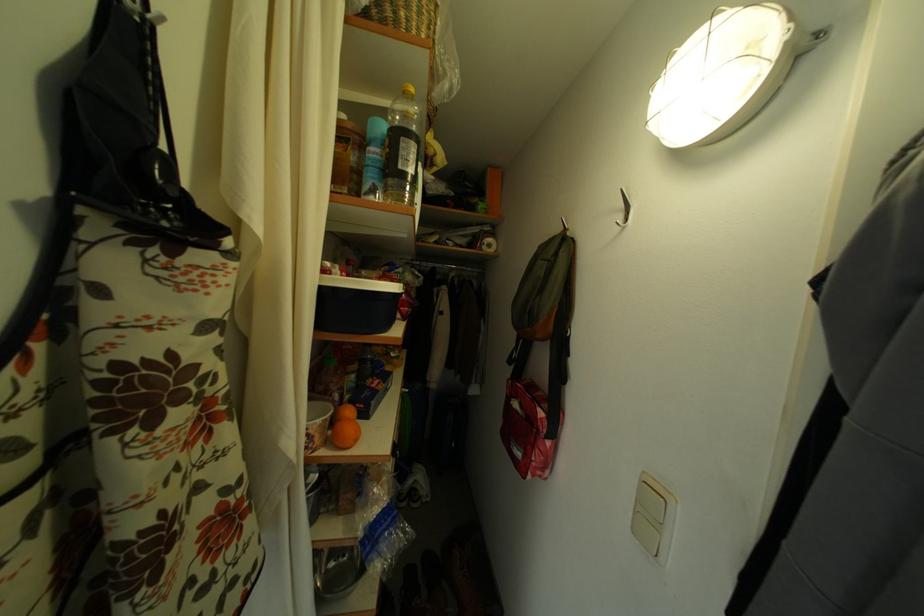
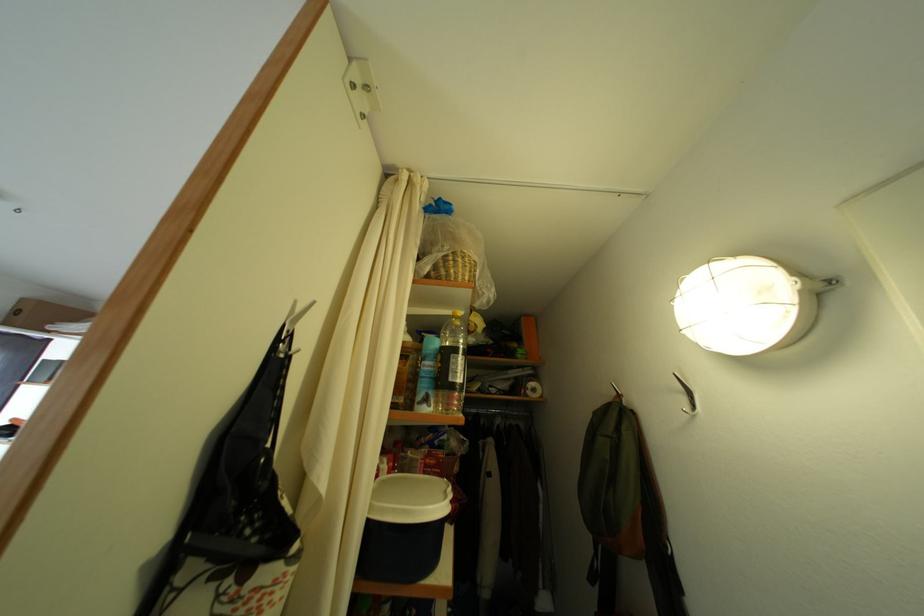
Question: How did the camera likely rotate?

Choices:
 (A) Left
 (B) Right
 (C) Up
 (D) Down

Answer: (C)